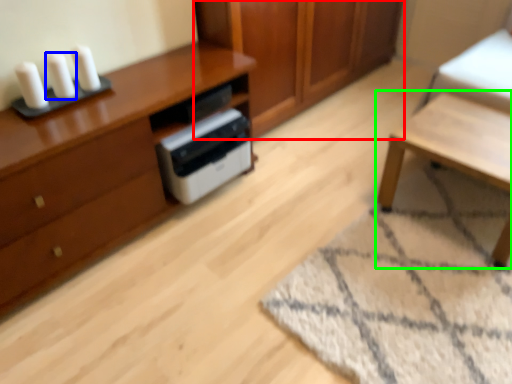
Question: Estimate the real-world distances between objects in this image. Which object is farther from cabinetry (highlighted by a red box), candle (highlighted by a blue box) or table (highlighted by a green box)?

Choices:
 (A) candle
 (B) table

Answer: (A)